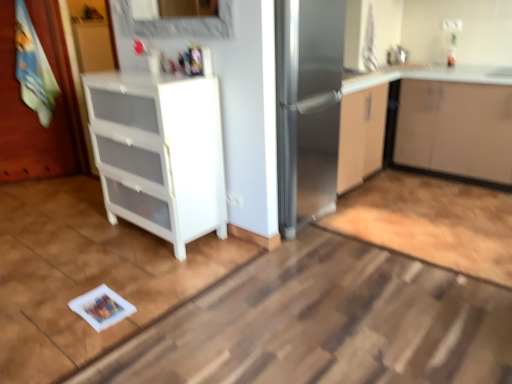
Question: Is white plastic drawer at center looking in the opposite direction of matte white cabinet at upper right, positioned as the 1th cabinetry in right-to-left order?

Choices:
 (A) no
 (B) yes

Answer: (A)

Question: Is white plastic drawer at center thinner than matte white cabinet at upper right, positioned as the 1th cabinetry in right-to-left order?

Choices:
 (A) no
 (B) yes

Answer: (A)

Question: Can we say white plastic drawer at center lies outside matte white cabinet at upper right, positioned as the 1th cabinetry in right-to-left order?

Choices:
 (A) no
 (B) yes

Answer: (B)

Question: Does white plastic drawer at center appear on the left side of matte white cabinet at upper right, which ranks as the second cabinetry in left-to-right order?

Choices:
 (A) no
 (B) yes

Answer: (B)

Question: Can you confirm if white plastic drawer at center is taller than matte white cabinet at upper right, which ranks as the second cabinetry in left-to-right order?

Choices:
 (A) no
 (B) yes

Answer: (A)

Question: Is white plastic drawer at center facing towards matte white cabinet at upper right, which ranks as the second cabinetry in left-to-right order?

Choices:
 (A) no
 (B) yes

Answer: (A)

Question: Are white plastic drawer unit at left, the 2th cabinetry positioned from the right, and stainless steel fridge at center beside each other?

Choices:
 (A) yes
 (B) no

Answer: (B)

Question: Does white plastic drawer unit at left, the 2th cabinetry positioned from the right, have a smaller size compared to stainless steel fridge at center?

Choices:
 (A) yes
 (B) no

Answer: (A)

Question: Is white plastic drawer unit at left, the 2th cabinetry positioned from the right, facing towards stainless steel fridge at center?

Choices:
 (A) yes
 (B) no

Answer: (B)

Question: Is white plastic drawer unit at left, the 2th cabinetry positioned from the right, oriented away from stainless steel fridge at center?

Choices:
 (A) no
 (B) yes

Answer: (B)

Question: Would you say stainless steel fridge at center is part of white plastic drawer unit at left, the 2th cabinetry positioned from the right,'s contents?

Choices:
 (A) no
 (B) yes

Answer: (A)

Question: Considering the relative positions of white plastic drawer unit at left, the 2th cabinetry positioned from the right, and stainless steel fridge at center in the image provided, is white plastic drawer unit at left, the 2th cabinetry positioned from the right, in front of stainless steel fridge at center?

Choices:
 (A) no
 (B) yes

Answer: (B)

Question: Is white plastic drawer unit at left, the 2th cabinetry positioned from the right, to the right of matte white cabinet at upper right, positioned as the 1th cabinetry in right-to-left order, from the viewer's perspective?

Choices:
 (A) no
 (B) yes

Answer: (A)